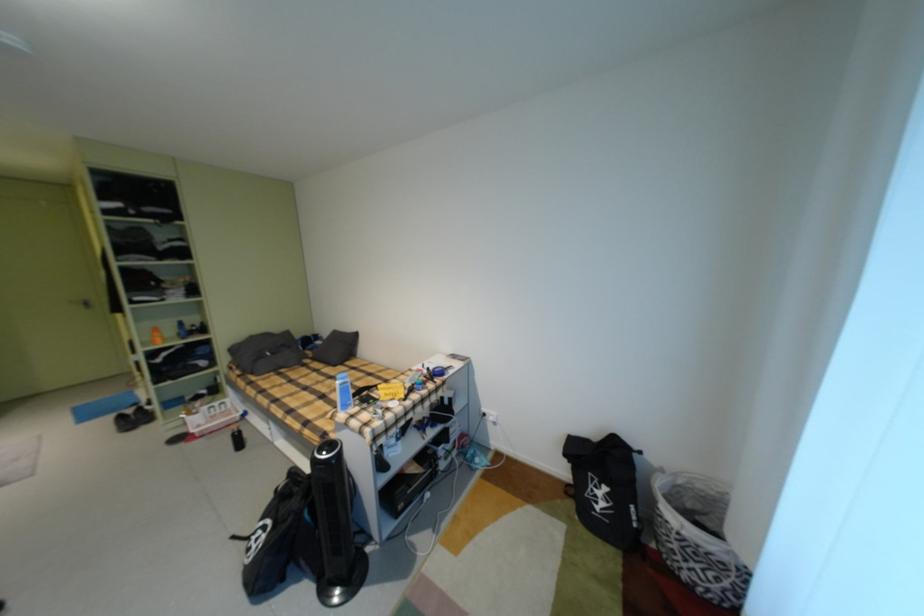
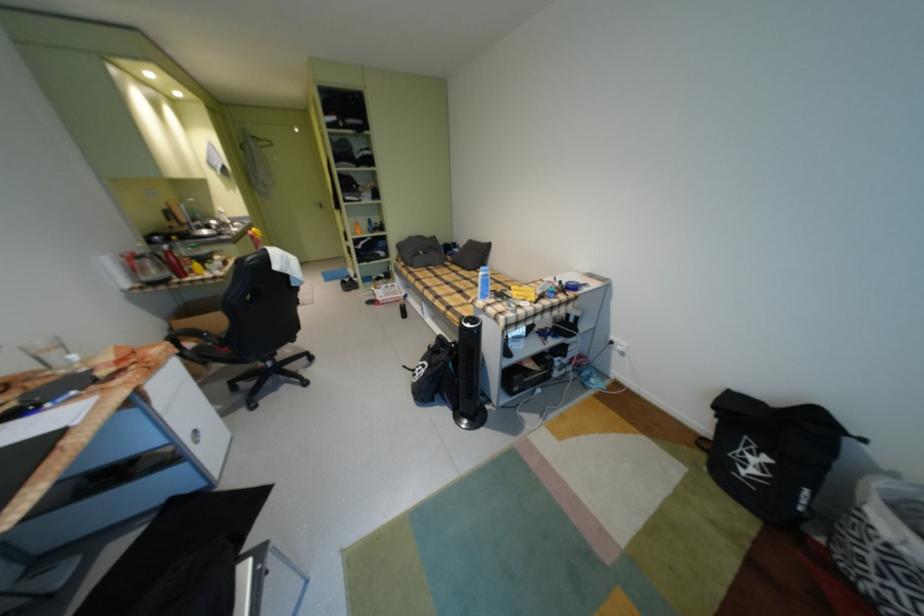
Based on the continuous images, in which direction is the camera rotating?

The camera's rotation is toward left-down.